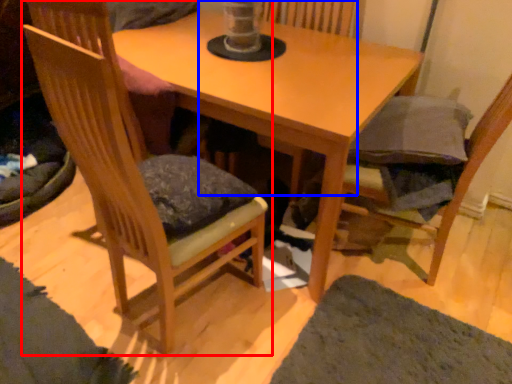
Question: Which of the following is the closest to the observer, chair (highlighted by a red box) or swivel chair (highlighted by a blue box)?

Choices:
 (A) chair
 (B) swivel chair

Answer: (A)